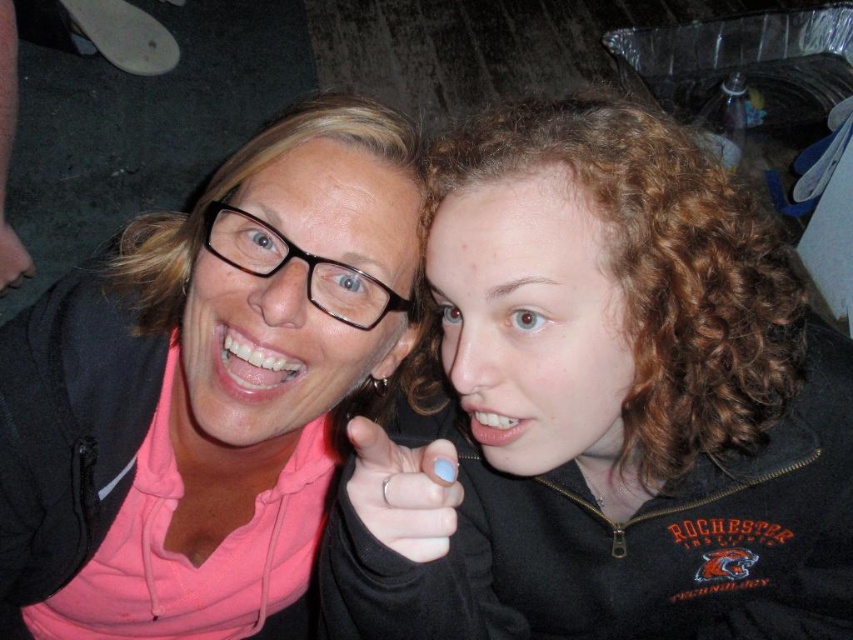
You are a photographer setting up for a group photo. You notice the matte black jacket at center and the blue matte nail polish at center in the frame. Which object is located to the right of the other?

Answer: The matte black jacket at center is positioned on the right side of blue matte nail polish at center, so the matte black jacket at center is to the right of the blue matte nail polish at center.

You are a photographer trying to frame a shot between the pink matte hoodie at upper left and the matte black hand at lower left. Which object should you focus on to ensure the wider subject is captured properly?

The pink matte hoodie at upper left is wider than the matte black hand at lower left, so you should focus on the pink matte hoodie at upper left to ensure the wider subject is captured properly.

You are a photographer setting up for a group photo. You want to ensure that the matte black jacket at center and the blue matte nail polish at center are visible in the frame. Given that your camera has a minimum focus distance of 10 inches, will you need to adjust your position to capture both objects clearly?

The distance between the matte black jacket at center and the blue matte nail polish at center is 9.43 inches, which is less than the camera minimum focus distance of 10 inches. Therefore, you need to move further away to ensure both objects are in focus.